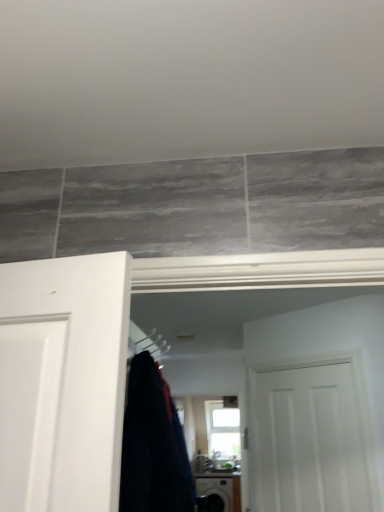
Question: Would you say black glossy washing machine at lower center is outside white matte door at center?

Choices:
 (A) no
 (B) yes

Answer: (B)

Question: Is the position of black glossy washing machine at lower center less distant than that of white matte door at center?

Choices:
 (A) yes
 (B) no

Answer: (B)

Question: Is white matte door at center located within black glossy washing machine at lower center?

Choices:
 (A) yes
 (B) no

Answer: (B)

Question: Considering the relative sizes of black glossy washing machine at lower center and white matte door at center in the image provided, is black glossy washing machine at lower center shorter than white matte door at center?

Choices:
 (A) yes
 (B) no

Answer: (A)

Question: From a real-world perspective, is black glossy washing machine at lower center positioned under white matte door at center based on gravity?

Choices:
 (A) yes
 (B) no

Answer: (A)

Question: Is white matte door at center to the left or to the right of silver metallic hanger at center in the image?

Choices:
 (A) left
 (B) right

Answer: (B)

Question: From a real-world perspective, is white matte door at center physically located above or below silver metallic hanger at center?

Choices:
 (A) below
 (B) above

Answer: (A)

Question: Considering the positions of white matte door at center and silver metallic hanger at center in the image, is white matte door at center bigger or smaller than silver metallic hanger at center?

Choices:
 (A) big
 (B) small

Answer: (A)

Question: Considering the positions of white matte door at center and silver metallic hanger at center in the image, is white matte door at center taller or shorter than silver metallic hanger at center?

Choices:
 (A) tall
 (B) short

Answer: (A)

Question: Is black glossy washing machine at lower center situated inside silver metallic hanger at center or outside?

Choices:
 (A) inside
 (B) outside

Answer: (B)

Question: From a real-world perspective, is black glossy washing machine at lower center above or below silver metallic hanger at center?

Choices:
 (A) below
 (B) above

Answer: (A)

Question: In terms of width, does black glossy washing machine at lower center look wider or thinner when compared to silver metallic hanger at center?

Choices:
 (A) wide
 (B) thin

Answer: (A)

Question: Is point (216, 480) positioned closer to the camera than point (150, 340)?

Choices:
 (A) farther
 (B) closer

Answer: (A)

Question: Considering the positions of dark blue fabric at center and silver metallic hanger at center in the image, is dark blue fabric at center bigger or smaller than silver metallic hanger at center?

Choices:
 (A) big
 (B) small

Answer: (A)

Question: Relative to silver metallic hanger at center, is dark blue fabric at center in front or behind?

Choices:
 (A) behind
 (B) front

Answer: (B)